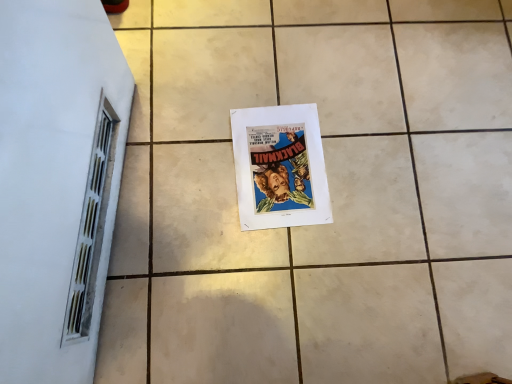
Find the location of a particular element. This screenshot has height=384, width=512. vibrant paper poster at center is located at coordinates (280, 167).

The width and height of the screenshot is (512, 384). Describe the element at coordinates (280, 167) in the screenshot. I see `vibrant paper poster at center` at that location.

Identify the location of vibrant paper poster at center. tap(280, 167).